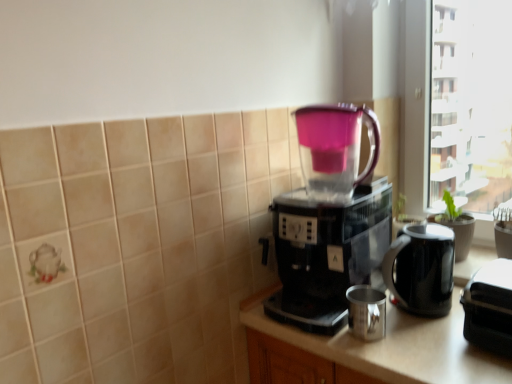
Question: Does metallic silver cup at center have a larger size compared to black plastic coffee maker at center?

Choices:
 (A) yes
 (B) no

Answer: (A)

Question: Is metallic silver cup at center looking in the opposite direction of black plastic coffee maker at center?

Choices:
 (A) yes
 (B) no

Answer: (B)

Question: Is metallic silver cup at center thinner than black plastic coffee maker at center?

Choices:
 (A) no
 (B) yes

Answer: (A)

Question: Would you consider metallic silver cup at center to be distant from black plastic coffee maker at center?

Choices:
 (A) no
 (B) yes

Answer: (A)

Question: From a real-world perspective, does metallic silver cup at center stand above black plastic coffee maker at center?

Choices:
 (A) yes
 (B) no

Answer: (B)

Question: Is metallic silver cup at center smaller than black plastic coffee maker at center?

Choices:
 (A) yes
 (B) no

Answer: (B)

Question: Is metallic silver mug at lower center bigger than black plastic coffee maker at center?

Choices:
 (A) yes
 (B) no

Answer: (B)

Question: Is metallic silver mug at lower center to the right of black plastic coffee maker at center from the viewer's perspective?

Choices:
 (A) yes
 (B) no

Answer: (A)

Question: Is metallic silver mug at lower center thinner than black plastic coffee maker at center?

Choices:
 (A) yes
 (B) no

Answer: (A)

Question: From the image's perspective, is metallic silver mug at lower center beneath black plastic coffee maker at center?

Choices:
 (A) yes
 (B) no

Answer: (A)

Question: Considering the relative sizes of metallic silver mug at lower center and black plastic coffee maker at center in the image provided, is metallic silver mug at lower center smaller than black plastic coffee maker at center?

Choices:
 (A) yes
 (B) no

Answer: (A)

Question: Would you say metallic silver mug at lower center is outside black plastic coffee maker at center?

Choices:
 (A) no
 (B) yes

Answer: (B)

Question: Can you confirm if transparent plastic pitcher at center is wider than black plastic coffee maker at center?

Choices:
 (A) no
 (B) yes

Answer: (A)